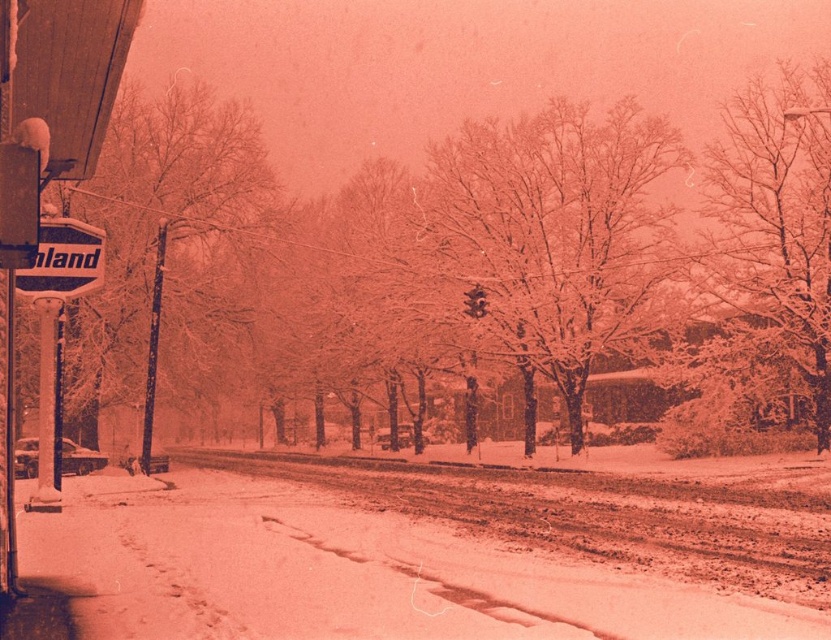
Question: Is snow-covered tree at center to the left of snow-covered tree at upper right from the viewer's perspective?

Choices:
 (A) no
 (B) yes

Answer: (B)

Question: Does snow-covered tree at upper right have a smaller size compared to metallic silver sign at left?

Choices:
 (A) no
 (B) yes

Answer: (A)

Question: Is snow-covered tree at left to the left of snow-covered tree at upper right from the viewer's perspective?

Choices:
 (A) yes
 (B) no

Answer: (A)

Question: Estimate the real-world distances between objects in this image. Which object is farther from the snow-covered tree at upper right?

Choices:
 (A) snow-covered tree at center
 (B) snow-covered tree at left

Answer: (B)

Question: Which object appears closest to the camera in this image?

Choices:
 (A) snow-covered tree at left
 (B) snow-covered tree at upper right
 (C) snow-covered tree at center
 (D) metallic silver sign at left

Answer: (D)

Question: Among these points, which one is nearest to the camera?

Choices:
 (A) (756, 108)
 (B) (190, 365)
 (C) (89, 232)
 (D) (547, 147)

Answer: (C)